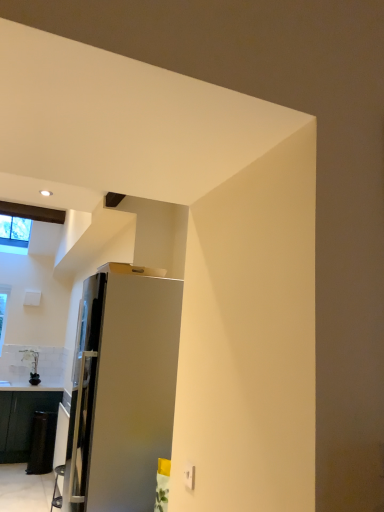
Question: Would you consider satin silver refrigerator at center to be distant from clear glass window at upper left?

Choices:
 (A) yes
 (B) no

Answer: (A)

Question: Is satin silver refrigerator at center to the left of clear glass window at upper left from the viewer's perspective?

Choices:
 (A) no
 (B) yes

Answer: (A)

Question: Is satin silver refrigerator at center taller than clear glass window at upper left?

Choices:
 (A) no
 (B) yes

Answer: (B)

Question: Does satin silver refrigerator at center lie in front of clear glass window at upper left?

Choices:
 (A) yes
 (B) no

Answer: (A)

Question: Is satin silver refrigerator at center bigger than clear glass window at upper left?

Choices:
 (A) no
 (B) yes

Answer: (B)

Question: Can you confirm if satin silver refrigerator at center is shorter than clear glass window at upper left?

Choices:
 (A) yes
 (B) no

Answer: (B)

Question: Can you confirm if black glossy cabinet at lower left is positioned to the left of clear glass window at upper left?

Choices:
 (A) yes
 (B) no

Answer: (B)

Question: From the image's perspective, is black glossy cabinet at lower left located beneath clear glass window at upper left?

Choices:
 (A) no
 (B) yes

Answer: (B)

Question: Can you confirm if black glossy cabinet at lower left is smaller than clear glass window at upper left?

Choices:
 (A) yes
 (B) no

Answer: (B)

Question: Can you confirm if black glossy cabinet at lower left is thinner than clear glass window at upper left?

Choices:
 (A) yes
 (B) no

Answer: (A)

Question: Considering the relative sizes of black glossy cabinet at lower left and clear glass window at upper left in the image provided, is black glossy cabinet at lower left taller than clear glass window at upper left?

Choices:
 (A) no
 (B) yes

Answer: (B)

Question: Is black glossy cabinet at lower left surrounding clear glass window at upper left?

Choices:
 (A) yes
 (B) no

Answer: (B)

Question: From the image's perspective, would you say satin silver refrigerator at center is shown under black glossy cabinet at lower left?

Choices:
 (A) no
 (B) yes

Answer: (A)